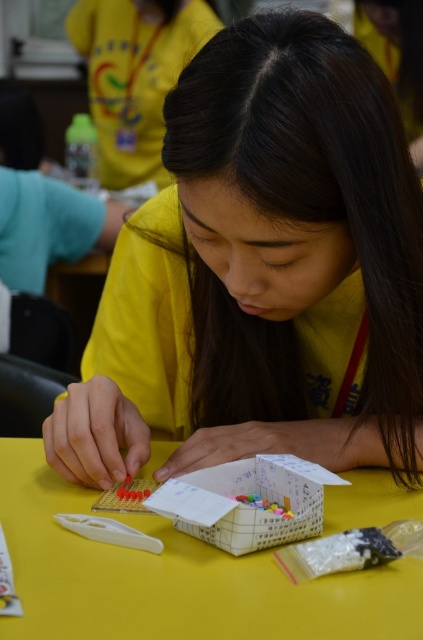
Question: Does matte yellow shirt at center have a lesser width compared to yellow matte table at center?

Choices:
 (A) yes
 (B) no

Answer: (A)

Question: Which of the following is the closest to the observer?

Choices:
 (A) yellow matte table at center
 (B) matte yellow shirt at center

Answer: (A)

Question: Among these objects, which one is nearest to the camera?

Choices:
 (A) matte yellow shirt at center
 (B) yellow matte table at center

Answer: (B)

Question: Is matte yellow shirt at center thinner than yellow matte table at center?

Choices:
 (A) yes
 (B) no

Answer: (A)

Question: Can you confirm if matte yellow shirt at center is positioned below yellow matte table at center?

Choices:
 (A) no
 (B) yes

Answer: (A)